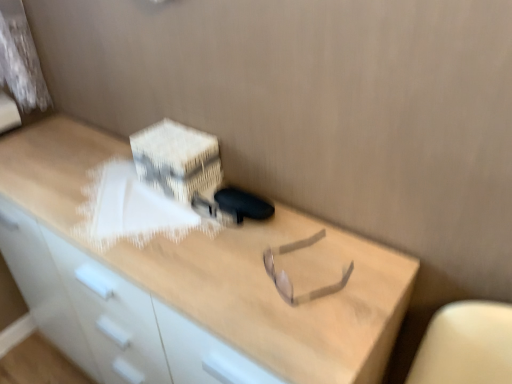
The width and height of the screenshot is (512, 384). What do you see at coordinates (176, 159) in the screenshot?
I see `white cardboard box at upper center` at bounding box center [176, 159].

You are a GUI agent. You are given a task and a screenshot of the screen. Output one action in this format:
    pyautogui.click(x=<x>, y=<y>)
    Task: Click on the white cardboard box at upper center
    This screenshot has height=384, width=512.
    Given the screenshot: What is the action you would take?
    pyautogui.click(x=176, y=159)

In order to face light wood desk at center, should I rotate leftwards or rightwards?

To align with it, rotate left about 11.731°.

Where is `light wood desk at center`? This screenshot has height=384, width=512. light wood desk at center is located at coordinates (188, 283).

Describe the element at coordinates (188, 283) in the screenshot. The width and height of the screenshot is (512, 384). I see `light wood desk at center` at that location.

Locate an element on the screen. white cardboard box at upper center is located at coordinates (176, 159).

Which object is positioned more to the left, light wood desk at center or white cardboard box at upper center?

light wood desk at center.

Which object is further away from the camera, light wood desk at center or white cardboard box at upper center?

Positioned behind is white cardboard box at upper center.

Is point (150, 287) closer or farther from the camera than point (183, 202)?

Point (150, 287) is closer to the camera than point (183, 202).

From the image's perspective, is light wood desk at center positioned above or below white cardboard box at upper center?

light wood desk at center is situated lower than white cardboard box at upper center in the image.

From a real-world perspective, which object stands above the other?

In real-world perspective, white cardboard box at upper center is above.

Can you confirm if light wood desk at center is thinner than white cardboard box at upper center?

No.

Based on the photo, does light wood desk at center have a lesser height compared to white cardboard box at upper center?

No, light wood desk at center is not shorter than white cardboard box at upper center.

Which of these two, light wood desk at center or white cardboard box at upper center, is smaller?

white cardboard box at upper center is smaller.

Do you think light wood desk at center is within white cardboard box at upper center, or outside of it?

light wood desk at center lies outside white cardboard box at upper center.

Is light wood desk at center next to white cardboard box at upper center?

No, light wood desk at center is not with white cardboard box at upper center.

Could you tell me if light wood desk at center is facing white cardboard box at upper center?

No, light wood desk at center is not aimed at white cardboard box at upper center.

What's the angular difference between light wood desk at center and white cardboard box at upper center's facing directions?

7.67e-05 degrees.

I want to click on desk on the left of white cardboard box at upper center, so pyautogui.click(x=188, y=283).

Does white cardboard box at upper center appear on the left side of light wood desk at center?

No, white cardboard box at upper center is not to the left of light wood desk at center.

Is the depth of white cardboard box at upper center greater than that of light wood desk at center?

Yes, it is behind light wood desk at center.

Is point (197, 190) in front of point (111, 223)?

No.

From the image's perspective, which object appears higher, white cardboard box at upper center or light wood desk at center?

From the image's view, white cardboard box at upper center is above.

From the picture: From a real-world perspective, is white cardboard box at upper center physically above light wood desk at center?

Yes, from a real-world perspective, white cardboard box at upper center is on top of light wood desk at center.

Considering the sizes of objects white cardboard box at upper center and light wood desk at center in the image provided, who is thinner, white cardboard box at upper center or light wood desk at center?

white cardboard box at upper center is thinner.

Does white cardboard box at upper center have a greater height compared to light wood desk at center?

Incorrect, the height of white cardboard box at upper center is not larger of that of light wood desk at center.

Considering the relative sizes of white cardboard box at upper center and light wood desk at center in the image provided, is white cardboard box at upper center bigger than light wood desk at center?

No, white cardboard box at upper center is not bigger than light wood desk at center.

Is white cardboard box at upper center not inside light wood desk at center?

That's correct, white cardboard box at upper center is outside of light wood desk at center.

Is white cardboard box at upper center with light wood desk at center?

No, white cardboard box at upper center is not in contact with light wood desk at center.

Is white cardboard box at upper center facing towards light wood desk at center?

No, white cardboard box at upper center is not oriented towards light wood desk at center.

How many degrees apart are the facing directions of white cardboard box at upper center and light wood desk at center?

The angular difference between white cardboard box at upper center and light wood desk at center is 7.67e-05 degrees.

Measure the distance from white cardboard box at upper center to light wood desk at center.

white cardboard box at upper center and light wood desk at center are 10.66 inches apart from each other.

Find the location of a particular element. This screenshot has width=512, height=384. desk that appears below the white cardboard box at upper center (from a real-world perspective) is located at coordinates (188, 283).

Locate an element on the screen. Image resolution: width=512 pixels, height=384 pixels. cardboard box behind the light wood desk at center is located at coordinates (176, 159).

This screenshot has height=384, width=512. In order to click on desk that appears below the white cardboard box at upper center (from the image's perspective) in this screenshot , I will do `click(188, 283)`.